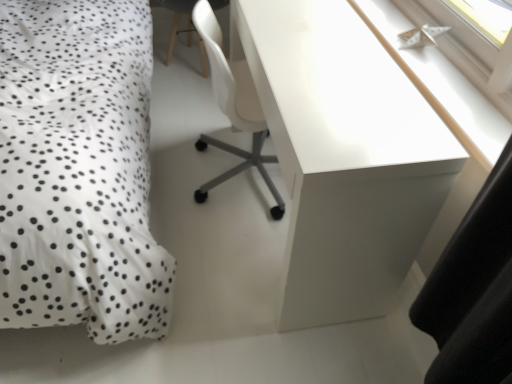
Identify the location of free space in front of white glossy desk at upper right. (247, 320).